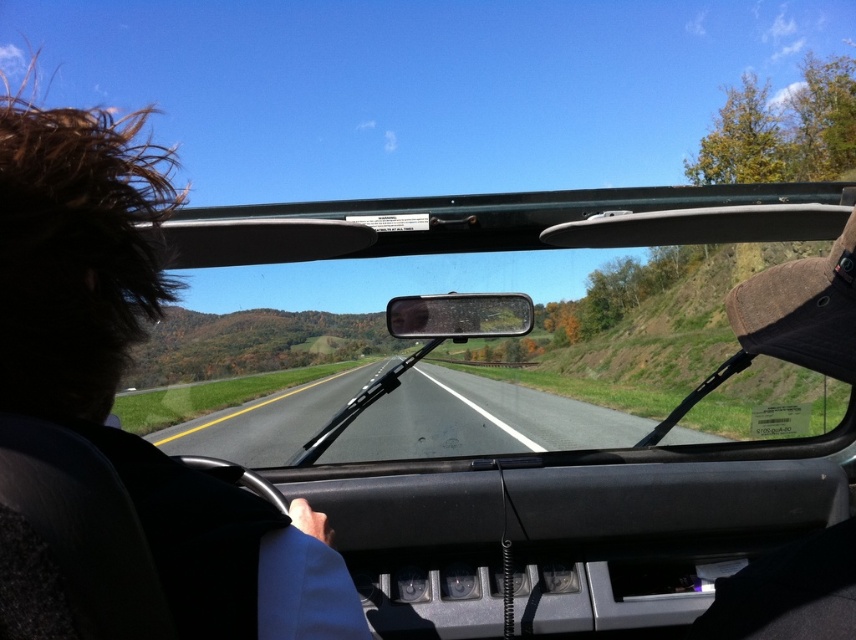
You are driving a car and looking through the transparent glass windshield at center. Which object is positioned to the right of the asphalt road at center?

The transparent glass windshield at center is positioned to the right of the asphalt road at center.

In the scene shown: You are a passenger in the car and want to see the road ahead clearly. Which object, the transparent glass windshield at center or the brown hair at upper left, is closer to your eyes?

The transparent glass windshield at center is closer to your eyes because it has a lesser height compared to the brown hair at upper left, meaning it is positioned lower and nearer in the field of view.

You are a passenger in the car and want to look at the road ahead. Which object is closer to your eyes between the transparent glass windshield at center and the brown hair at upper left?

The brown hair at upper left is closer to your eyes because it is positioned above the transparent glass windshield at center, which is located further away.